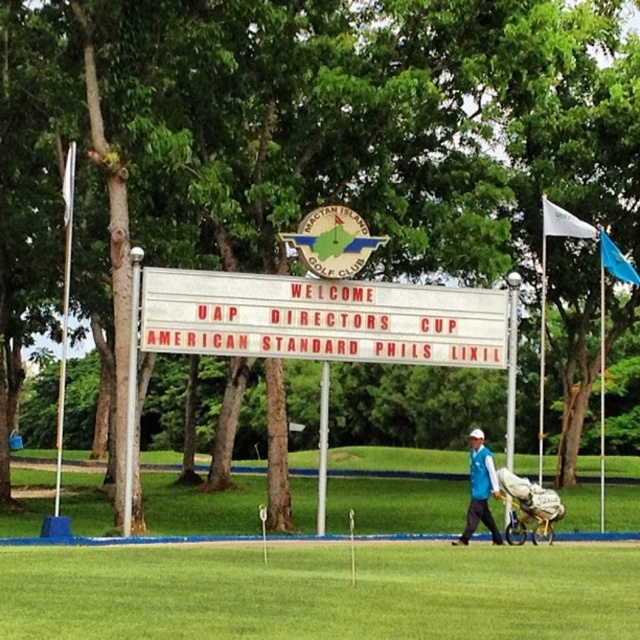
You are a golfer standing at the tee box and see the white plastic sign at center and the blue fabric golfer at center. Which object is wider from your perspective?

The white plastic sign at center is wider than the blue fabric golfer at center according to the description.

You are standing at the bottom left corner of the image. You want to walk directly towards the blue fabric golfer at center. Which direction should you head?

You should head northeast towards the blue fabric golfer at center because its coordinates are at point (480, 490), which is northeast of the bottom left corner.